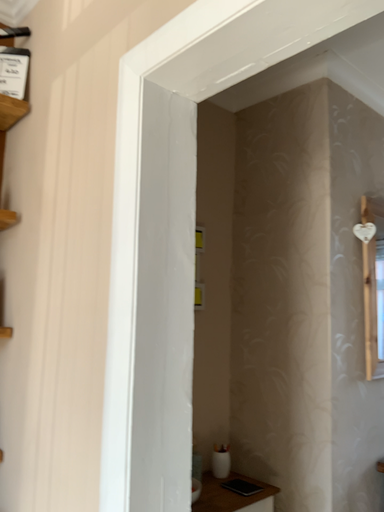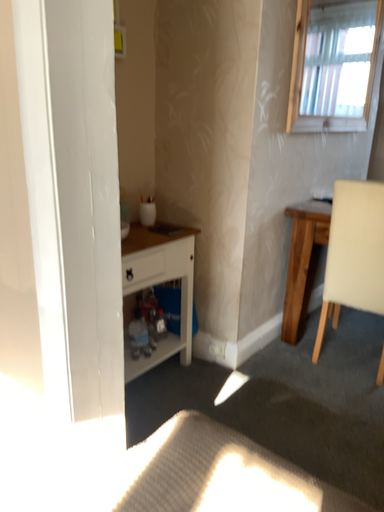
Question: Which way did the camera rotate in the video?

Choices:
 (A) rotated downward
 (B) rotated upward

Answer: (A)